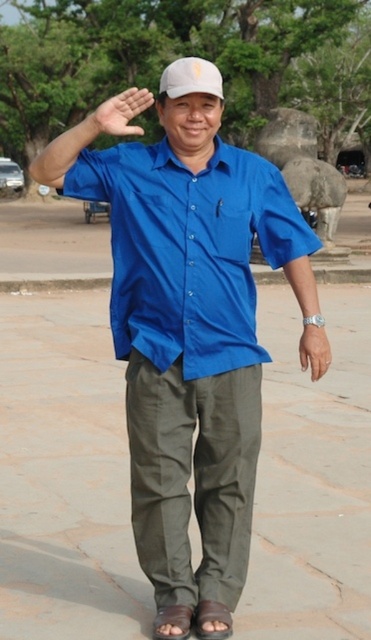
You are an architect designing a drone delivery path. The drone must fly from the person to the white matte baseball hat at center. According to the coordinates provided, will the drone need to adjust its path to avoid the large weathered stone structure?

The white matte baseball hat at center is located at point (189, 77). Since the coordinates are relative to the image, the drone should follow the direct path unless the stone structure is in that coordinate area. However, the description mentions the stone structure is partially visible behind the person, so the drone path from the person to the hat might pass near the structure. The drone may need to adjust its path to avoid collision with the stone structure.

You are a photographer trying to capture a closeup of the smooth skin hand at center and the matte brown wristwatch at lower right. Which object should you focus on first if you want to ensure both are in focus?

The smooth skin hand at center is above the matte brown wristwatch at lower right, so you should focus on the smooth skin hand at center first to ensure both are in focus.

You are a photographer capturing a portrait of the person. You need to ensure that both the smooth skin hand at center and the matte brown wristwatch at lower right are clearly visible in the frame. Based on their positions, which object should you focus on first to ensure both are in focus?

The smooth skin hand at center is positioned on the left side of matte brown wristwatch at lower right. To ensure both are in focus, you should focus on the smooth skin hand at center first since it is closer to the camera, allowing the wristwatch to fall within the depth of field.